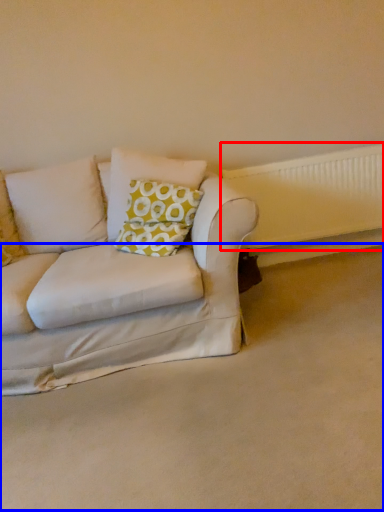
Question: Which object appears farthest to the camera in this image, radiator (highlighted by a red box) or plain (highlighted by a blue box)?

Choices:
 (A) radiator
 (B) plain

Answer: (A)